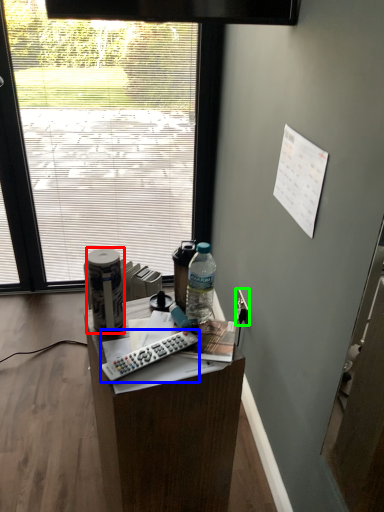
Question: Which is farther away from bottle (highlighted by a red box)? remote control (highlighted by a blue box) or power outlet (highlighted by a green box)?

Choices:
 (A) remote control
 (B) power outlet

Answer: (B)